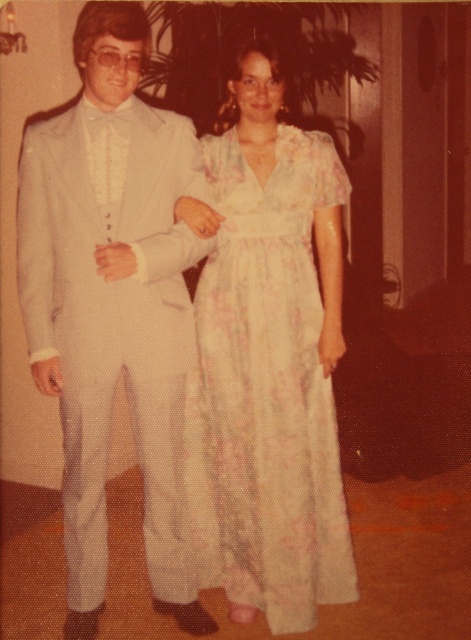
Is matte white suit at left bigger than floral chiffon dress at center?

Correct, matte white suit at left is larger in size than floral chiffon dress at center.

Is matte white suit at left smaller than floral chiffon dress at center?

No.

I want to click on matte white suit at left, so click(x=110, y=305).